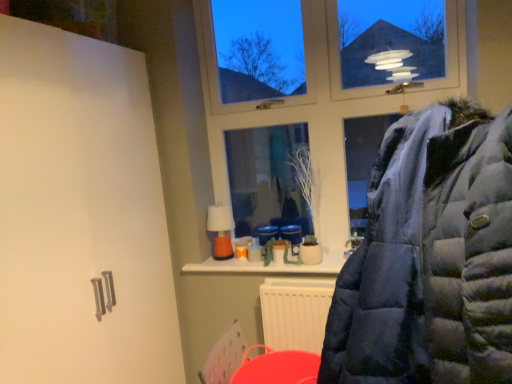
Question: From the image's perspective, is rubberized plastic bucket at lower center above or below dark blue puffer jacket at center?

Choices:
 (A) below
 (B) above

Answer: (A)

Question: From their relative heights in the image, would you say rubberized plastic bucket at lower center is taller or shorter than dark blue puffer jacket at center?

Choices:
 (A) tall
 (B) short

Answer: (B)

Question: Which of these objects is positioned closest to the transparent glass window at upper center?

Choices:
 (A) dark blue puffer jacket at center
 (B) rubberized plastic bucket at lower center

Answer: (B)

Question: Based on their relative distances, which object is nearer to the dark blue puffer jacket at center?

Choices:
 (A) rubberized plastic bucket at lower center
 (B) transparent glass window at upper center

Answer: (A)